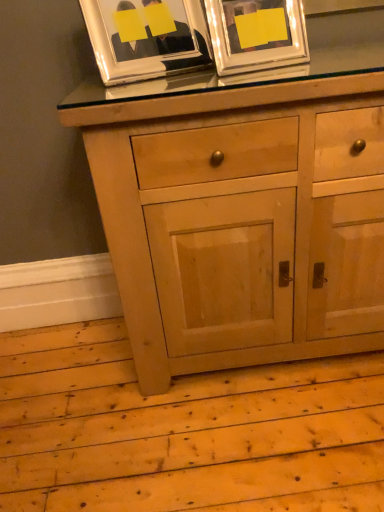
Question: Can you confirm if natural wood cabinet at center is taller than silver metallic picture frame at upper left, the 1th picture frame viewed from the left?

Choices:
 (A) yes
 (B) no

Answer: (A)

Question: Is natural wood cabinet at center not inside silver metallic picture frame at upper left, the 2th picture frame when ordered from right to left?

Choices:
 (A) yes
 (B) no

Answer: (A)

Question: Considering the relative positions of natural wood cabinet at center and silver metallic picture frame at upper left, the 1th picture frame viewed from the left, in the image provided, is natural wood cabinet at center in front of silver metallic picture frame at upper left, the 1th picture frame viewed from the left,?

Choices:
 (A) yes
 (B) no

Answer: (A)

Question: Is natural wood cabinet at center shorter than silver metallic picture frame at upper left, the 1th picture frame viewed from the left?

Choices:
 (A) yes
 (B) no

Answer: (B)

Question: Is natural wood cabinet at center smaller than silver metallic picture frame at upper left, the 2th picture frame when ordered from right to left?

Choices:
 (A) no
 (B) yes

Answer: (A)

Question: Is point (130, 69) closer or farther from the camera than point (296, 92)?

Choices:
 (A) closer
 (B) farther

Answer: (B)

Question: Is silver metallic picture frame at upper left, the 2th picture frame when ordered from right to left, bigger or smaller than natural wood cabinet at center?

Choices:
 (A) small
 (B) big

Answer: (A)

Question: Is silver metallic picture frame at upper left, the 2th picture frame when ordered from right to left, to the left or to the right of natural wood cabinet at center in the image?

Choices:
 (A) right
 (B) left

Answer: (B)

Question: In terms of height, does silver metallic picture frame at upper left, the 2th picture frame when ordered from right to left, look taller or shorter compared to natural wood cabinet at center?

Choices:
 (A) tall
 (B) short

Answer: (B)

Question: Based on their sizes in the image, would you say metallic silver picture frame at upper center, the first picture frame from the right, is bigger or smaller than natural wood cabinet at center?

Choices:
 (A) big
 (B) small

Answer: (B)

Question: Is metallic silver picture frame at upper center, the first picture frame from the right, inside or outside of natural wood cabinet at center?

Choices:
 (A) outside
 (B) inside

Answer: (A)

Question: Considering the positions of point (223, 7) and point (289, 209), is point (223, 7) closer or farther from the camera than point (289, 209)?

Choices:
 (A) farther
 (B) closer

Answer: (B)

Question: From the image's perspective, is metallic silver picture frame at upper center, the second picture frame viewed from the left, above or below natural wood cabinet at center?

Choices:
 (A) below
 (B) above

Answer: (B)

Question: Considering the relative positions of natural wood cabinet at center and metallic silver picture frame at upper center, the second picture frame viewed from the left, in the image provided, is natural wood cabinet at center to the left or to the right of metallic silver picture frame at upper center, the second picture frame viewed from the left,?

Choices:
 (A) left
 (B) right

Answer: (B)

Question: From the image's perspective, is natural wood cabinet at center located above or below metallic silver picture frame at upper center, the second picture frame viewed from the left?

Choices:
 (A) below
 (B) above

Answer: (A)